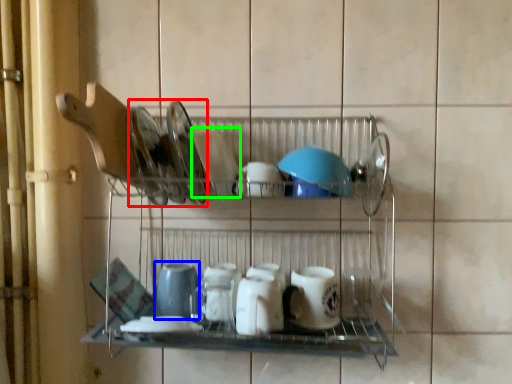
Question: Which object is positioned farthest from tableware (highlighted by a red box)? Select from appliance (highlighted by a blue box) and tableware (highlighted by a green box).

Choices:
 (A) appliance
 (B) tableware

Answer: (A)